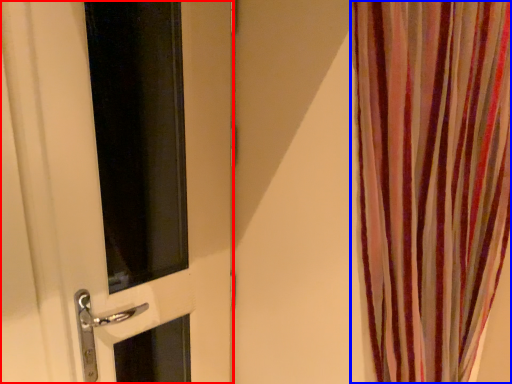
Question: Which of the following is the farthest to the observer, door (highlighted by a red box) or curtain (highlighted by a blue box)?

Choices:
 (A) door
 (B) curtain

Answer: (A)